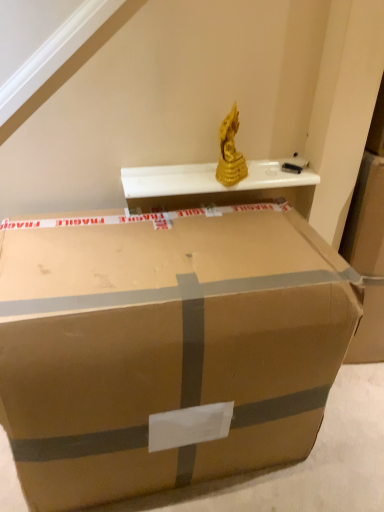
Question: From their relative heights in the image, would you say brown cardboard box at center is taller or shorter than white glossy shelf at upper center?

Choices:
 (A) tall
 (B) short

Answer: (A)

Question: In the image, is brown cardboard box at center positioned in front of or behind white glossy shelf at upper center?

Choices:
 (A) behind
 (B) front

Answer: (B)

Question: In terms of width, does brown cardboard box at center look wider or thinner when compared to white glossy shelf at upper center?

Choices:
 (A) wide
 (B) thin

Answer: (A)

Question: From the image's perspective, is white glossy shelf at upper center located above or below brown cardboard box at center?

Choices:
 (A) below
 (B) above

Answer: (B)

Question: Does point (152, 169) appear closer or farther from the camera than point (266, 412)?

Choices:
 (A) farther
 (B) closer

Answer: (A)

Question: In terms of height, does white glossy shelf at upper center look taller or shorter compared to brown cardboard box at center?

Choices:
 (A) short
 (B) tall

Answer: (A)

Question: Do you think white glossy shelf at upper center is within brown cardboard box at center, or outside of it?

Choices:
 (A) outside
 (B) inside

Answer: (A)